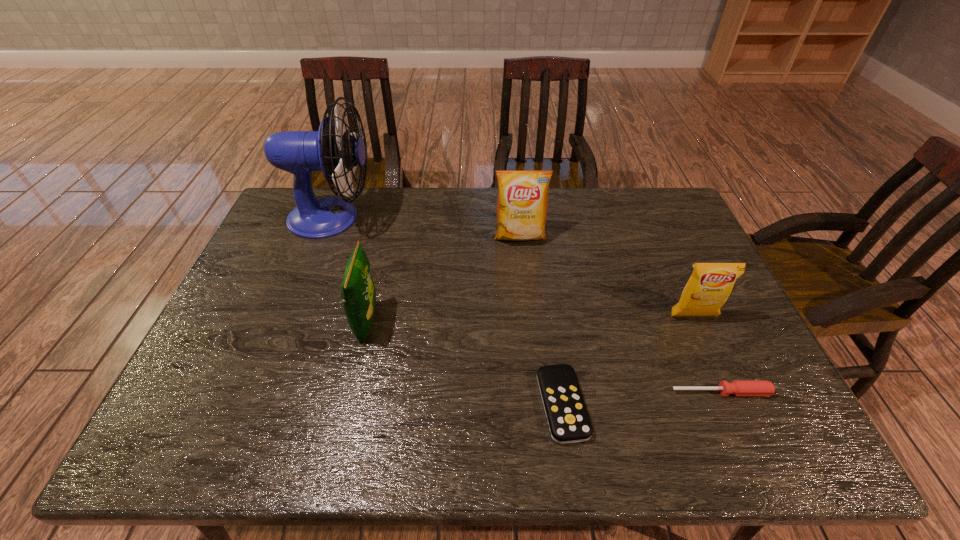
At what (x,y) coordinates should I click in order to perform the action: click on vacant space located 0.310m on the front of the rightmost crisp (potato chip) with the logo. Please return your answer as a coordinate pair (x, y). Looking at the image, I should click on (745, 433).

Identify the location of vacant point located 0.110m on the left of the screwdriver. The height and width of the screenshot is (540, 960). (625, 392).

Identify the location of vacant space positioned 0.140m on the right of the remote control. Image resolution: width=960 pixels, height=540 pixels. (647, 404).

The height and width of the screenshot is (540, 960). In order to click on fan present at the far edge in this screenshot , I will do point(333,150).

Where is `crisp (potato chip) positioned at the far edge`? This screenshot has height=540, width=960. crisp (potato chip) positioned at the far edge is located at coordinates [522, 204].

Where is `object positioned at the near edge`? The height and width of the screenshot is (540, 960). object positioned at the near edge is located at coordinates (568, 420).

Where is `object present at the left edge`? The width and height of the screenshot is (960, 540). object present at the left edge is located at coordinates (333, 150).

Where is `crisp (potato chip) at the right edge`? crisp (potato chip) at the right edge is located at coordinates (708, 288).

Locate an element on the screen. The width and height of the screenshot is (960, 540). screwdriver present at the right edge is located at coordinates (738, 387).

Identify the location of object located at the far left corner. This screenshot has width=960, height=540. (333, 150).